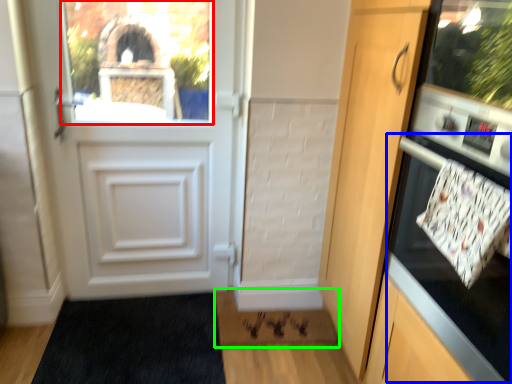
Question: Based on their relative distances, which object is nearer to window screen (highlighted by a red box)? Choose from oven (highlighted by a blue box) and doormat (highlighted by a green box).

Choices:
 (A) oven
 (B) doormat

Answer: (B)